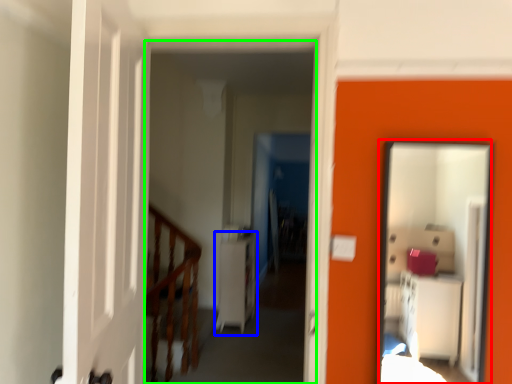
Question: Which is nearer to the mirror (highlighted by a red box)? dresser (highlighted by a blue box) or corridor (highlighted by a green box).

Choices:
 (A) dresser
 (B) corridor

Answer: (A)